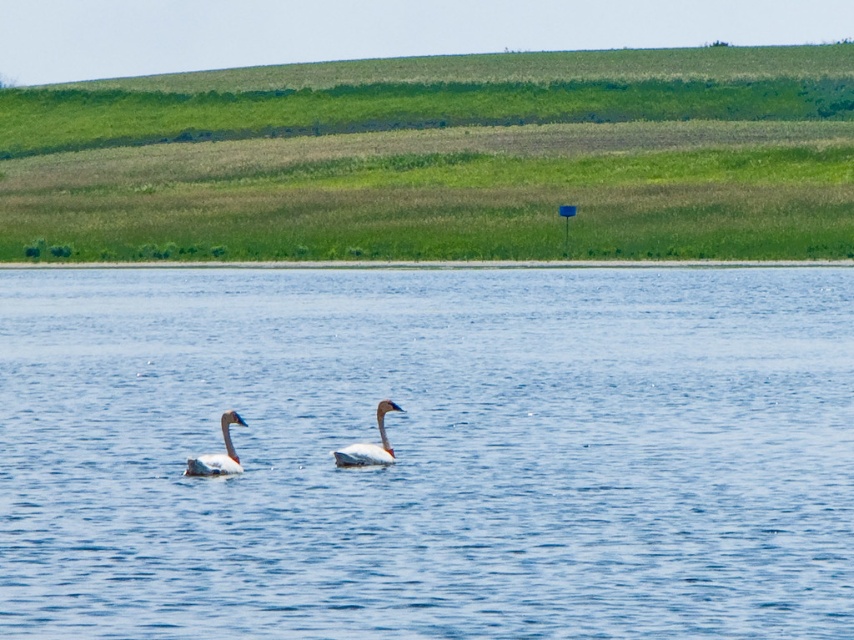
Does green grassy hillside at upper center have a greater height compared to white matte swan at left?

Correct, green grassy hillside at upper center is much taller as white matte swan at left.

Can you confirm if green grassy hillside at upper center is wider than white matte swan at left?

Indeed, green grassy hillside at upper center has a greater width compared to white matte swan at left.

Which is in front, point (630, 202) or point (226, 460)?

Point (226, 460)

This screenshot has height=640, width=854. In order to click on green grassy hillside at upper center in this screenshot , I will do (442, 157).

This screenshot has width=854, height=640. In order to click on green grassy hillside at upper center in this screenshot , I will do `click(442, 157)`.

Is point (729, 132) positioned before point (370, 458)?

No, it is not.

Where is `green grassy hillside at upper center`? The image size is (854, 640). green grassy hillside at upper center is located at coordinates (442, 157).

Identify the location of green grassy hillside at upper center. This screenshot has width=854, height=640. pos(442,157).

Looking at this image, can you confirm if blue water at center is taller than white matte swan at left?

Indeed, blue water at center has a greater height compared to white matte swan at left.

The height and width of the screenshot is (640, 854). I want to click on blue water at center, so click(x=428, y=452).

Identify the location of blue water at center. (428, 452).